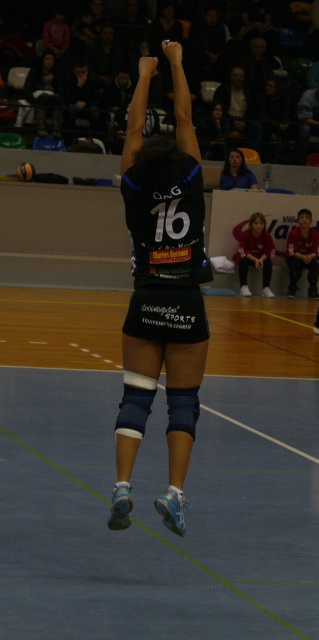
Is the position of black matte uniform at center less distant than that of matte red shirt at center?

Yes, black matte uniform at center is in front of matte red shirt at center.

Who is higher up, black matte uniform at center or matte red shirt at center?

matte red shirt at center is higher up.

Identify the location of black matte uniform at center. (162, 291).

Can you confirm if matte red shirt at center is taller than smooth skin face at upper center?

Indeed, matte red shirt at center has a greater height compared to smooth skin face at upper center.

Is matte red shirt at center to the left of smooth skin face at upper center from the viewer's perspective?

Incorrect, matte red shirt at center is not on the left side of smooth skin face at upper center.

Does point (259, 266) come behind point (238, 150)?

No, (259, 266) is in front of (238, 150).

Where is `matte red shirt at center`? The width and height of the screenshot is (319, 640). matte red shirt at center is located at coordinates (256, 253).

Which is in front, point (188, 218) or point (29, 177)?

Point (188, 218)

Is black matte uniform at center bigger than yellow rubber volleyball at center?

Yes.

Where is `black matte uniform at center`? This screenshot has width=319, height=640. black matte uniform at center is located at coordinates (162, 291).